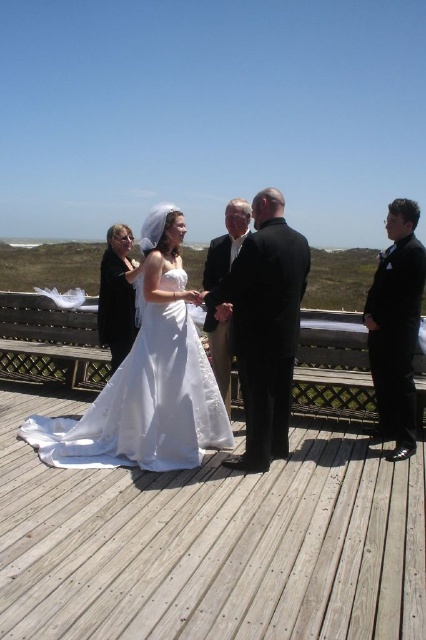
Question: Which of the following is the closest to the observer?

Choices:
 (A) (417, 260)
 (B) (150, 445)

Answer: (B)

Question: In this image, where is white satin dress at center located relative to smooth black suit at center?

Choices:
 (A) right
 (B) left

Answer: (B)

Question: Which point is closer to the camera?

Choices:
 (A) dark suit at center
 (B) wooden at center

Answer: (B)

Question: Does dark suit at center appear on the right side of matte black dress at left?

Choices:
 (A) no
 (B) yes

Answer: (B)

Question: Is wooden at center below black satin suit at right?

Choices:
 (A) yes
 (B) no

Answer: (A)

Question: Which point is closer to the camera?

Choices:
 (A) (284, 332)
 (B) (241, 209)
 (C) (149, 365)
 (D) (411, 252)

Answer: (A)